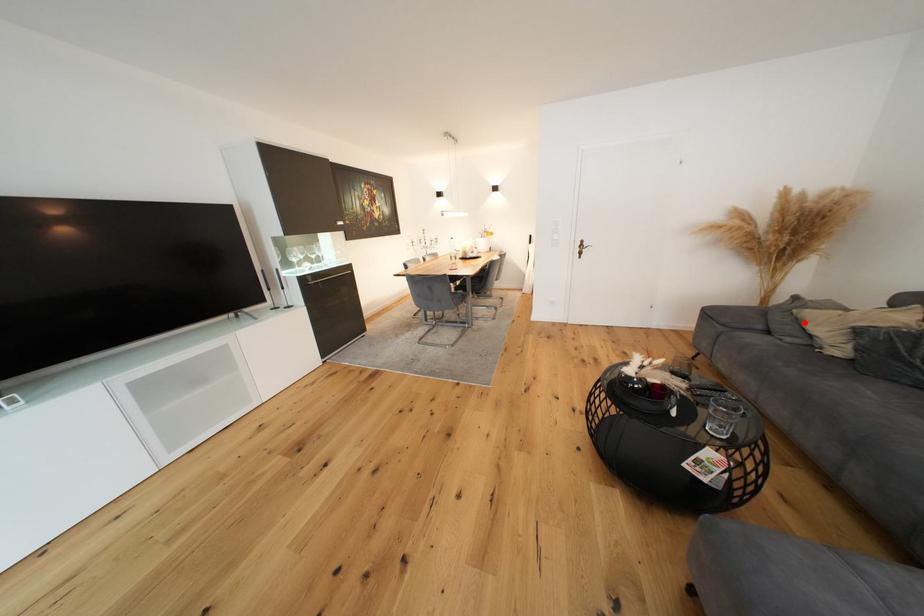
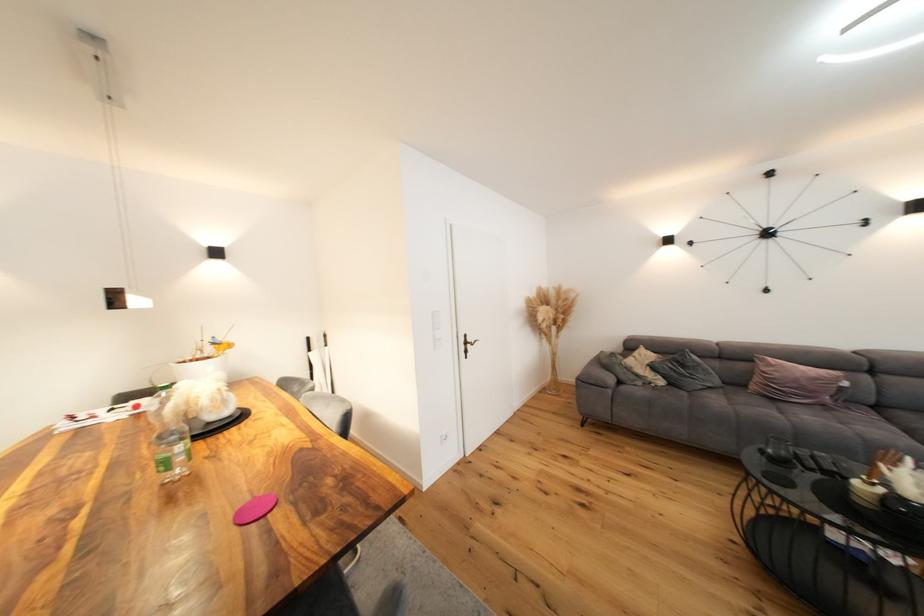
Locate, in the second image, the point that corresponds to the highlighted location in the first image.

(637, 371)